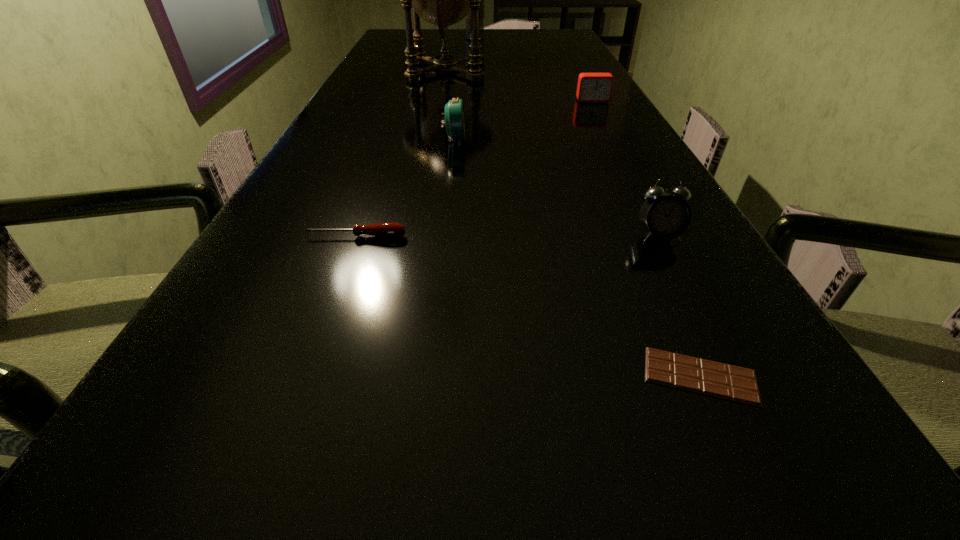
Identify the location of the shortest object. The height and width of the screenshot is (540, 960). (715, 379).

Image resolution: width=960 pixels, height=540 pixels. Identify the location of the nearest object. (715, 379).

The image size is (960, 540). Identify the location of blank area located 0.200m on the front-facing side of the globe. (558, 70).

Image resolution: width=960 pixels, height=540 pixels. Identify the location of vacant space located 0.230m on the left of the wine bottle. (406, 38).

Identify the location of vacant space situated on the front-facing side of the fourth farthest object. (536, 140).

The image size is (960, 540). Find the location of `free space located 0.180m on the face of the nearest alarm clock`. free space located 0.180m on the face of the nearest alarm clock is located at coordinates (708, 329).

Find the location of a particular element. free space located on the front-facing side of the farthest alarm clock is located at coordinates (619, 150).

Image resolution: width=960 pixels, height=540 pixels. What are the coordinates of `vacant space located on the back of the screwdriver` in the screenshot? It's located at (394, 134).

You are a GUI agent. You are given a task and a screenshot of the screen. Output one action in this format:
    pyautogui.click(x=<x>, y=<y>)
    Task: Click on the vacant area located 0.140m on the left of the shortest object
    The width and height of the screenshot is (960, 540).
    Given the screenshot: What is the action you would take?
    pyautogui.click(x=525, y=376)

Where is `object positioned at the far edge`? The image size is (960, 540). object positioned at the far edge is located at coordinates tap(481, 11).